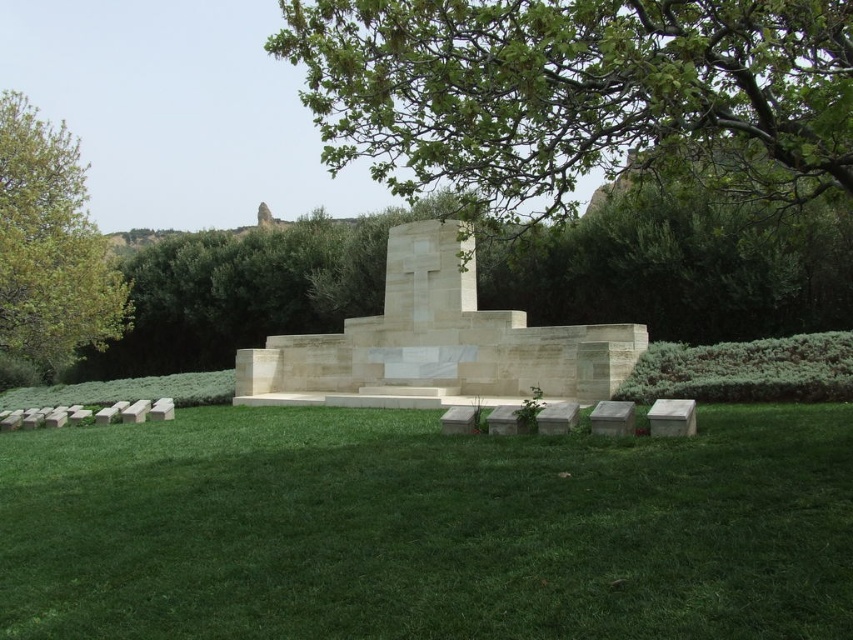
Between green leafy tree at upper center and green leafy tree at left, which one appears on the right side from the viewer's perspective?

green leafy tree at upper center is more to the right.

Which is above, green leafy tree at upper center or green leafy tree at left?

Positioned higher is green leafy tree at upper center.

The height and width of the screenshot is (640, 853). What do you see at coordinates (575, 92) in the screenshot?
I see `green leafy tree at upper center` at bounding box center [575, 92].

The width and height of the screenshot is (853, 640). Identify the location of green leafy tree at upper center. (575, 92).

Between green grass at lower center and white stone cross at center, which one appears on the left side from the viewer's perspective?

white stone cross at center

Does green grass at lower center have a greater width compared to white stone cross at center?

Yes, green grass at lower center is wider than white stone cross at center.

Describe the element at coordinates (426, 529) in the screenshot. The height and width of the screenshot is (640, 853). I see `green grass at lower center` at that location.

In order to click on green grass at lower center in this screenshot , I will do `click(426, 529)`.

Between point (814, 461) and point (318, 77), which one is positioned behind?

Positioned behind is point (318, 77).

Can you confirm if green grass at lower center is positioned to the right of green leafy tree at upper center?

Incorrect, green grass at lower center is not on the right side of green leafy tree at upper center.

Between point (625, 490) and point (381, 147), which one is positioned behind?

The point (381, 147) is behind.

Where is `green grass at lower center`? The width and height of the screenshot is (853, 640). green grass at lower center is located at coordinates (426, 529).